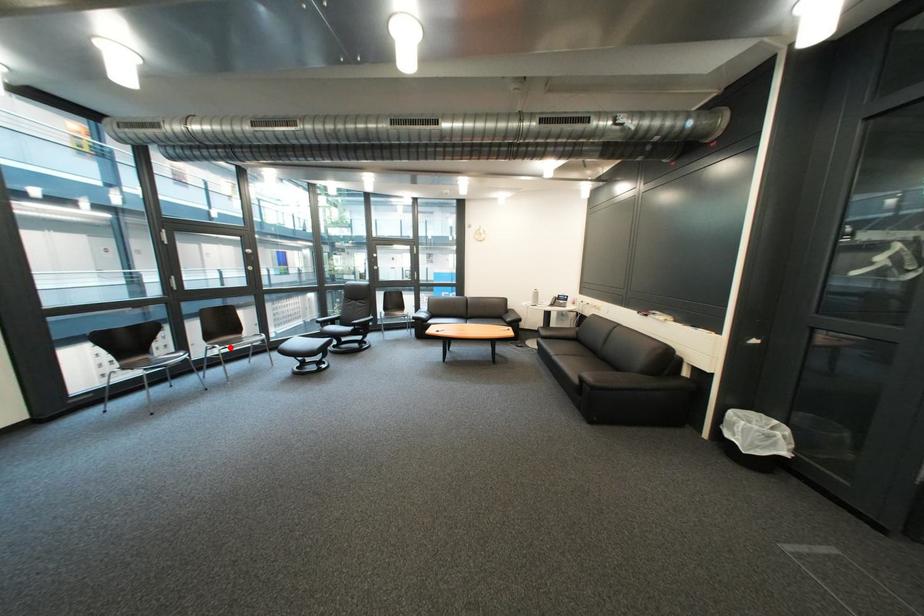
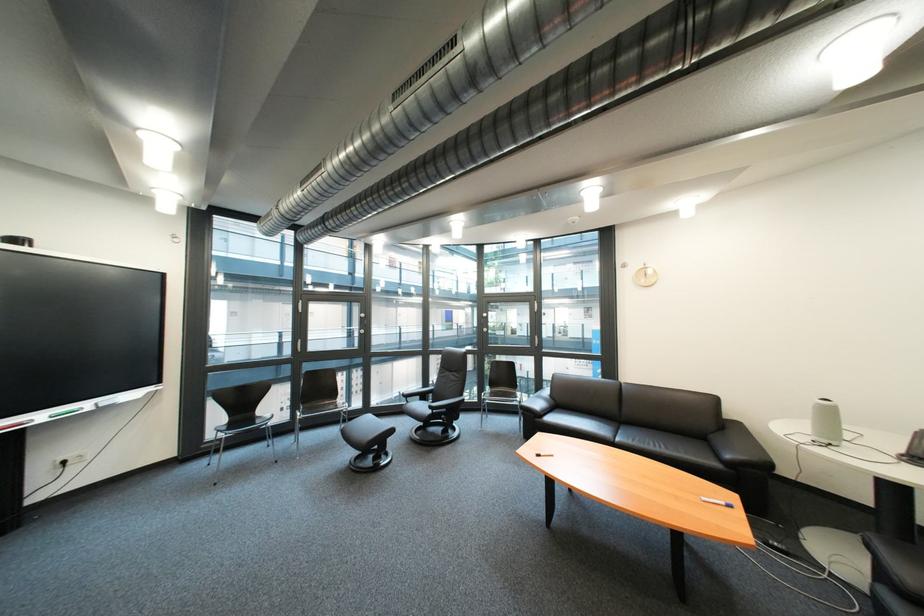
Question: I am providing you with two images of the same scene from different viewpoints. Image1 has a red point marked. In image2, the corresponding 3D location appears at what relative position? Reply with the corresponding letter.

Choices:
 (A) Closer
 (B) Farther

Answer: (B)